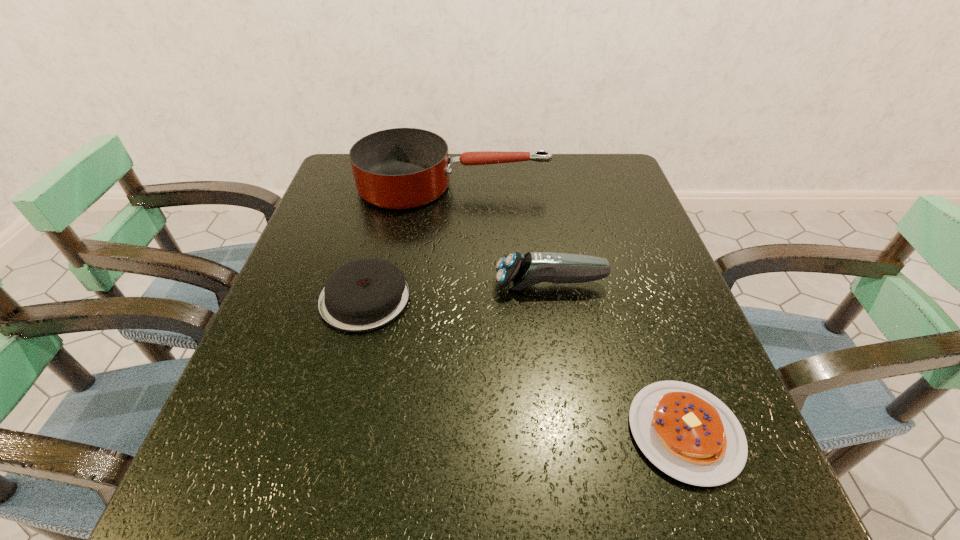
The width and height of the screenshot is (960, 540). Find the location of `vacant point that satisfies the following two spatial constraints: 1. on the handle side of the tallest object; 2. on the back side of the nearer pancake`. vacant point that satisfies the following two spatial constraints: 1. on the handle side of the tallest object; 2. on the back side of the nearer pancake is located at coordinates (434, 432).

Where is `vacant space that satisfies the following two spatial constraints: 1. on the head of the electric shaver; 2. on the back side of the nearer pancake`? vacant space that satisfies the following two spatial constraints: 1. on the head of the electric shaver; 2. on the back side of the nearer pancake is located at coordinates (574, 432).

The image size is (960, 540). Identify the location of free space that satisfies the following two spatial constraints: 1. on the head of the third shortest object; 2. on the left side of the nearer pancake. (574, 432).

You are a GUI agent. You are given a task and a screenshot of the screen. Output one action in this format:
    pyautogui.click(x=<x>, y=<y>)
    Task: Click on the free space that satisfies the following two spatial constraints: 1. on the handle side of the farthest object; 2. on the right side of the shortest object
    This screenshot has height=540, width=960.
    Given the screenshot: What is the action you would take?
    pyautogui.click(x=434, y=432)

This screenshot has height=540, width=960. What are the coordinates of `vacant space that satisfies the following two spatial constraints: 1. on the handle side of the tallest object; 2. on the right side of the right pancake` in the screenshot? It's located at (434, 432).

Find the location of a particular element. The height and width of the screenshot is (540, 960). free location that satisfies the following two spatial constraints: 1. on the handle side of the farthest object; 2. on the left side of the shortest object is located at coordinates 434,432.

At what (x,y) coordinates should I click in order to perform the action: click on free spot that satisfies the following two spatial constraints: 1. on the head of the second tallest object; 2. on the back side of the right pancake. Please return your answer as a coordinate pair (x, y). Looking at the image, I should click on (574, 432).